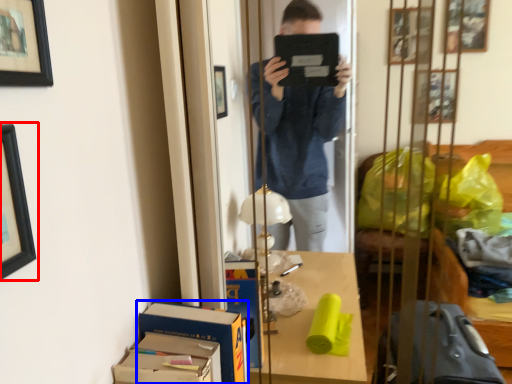
Question: Which object is further to the camera taking this photo, picture frame (highlighted by a red box) or cardboard box (highlighted by a blue box)?

Choices:
 (A) picture frame
 (B) cardboard box

Answer: (B)